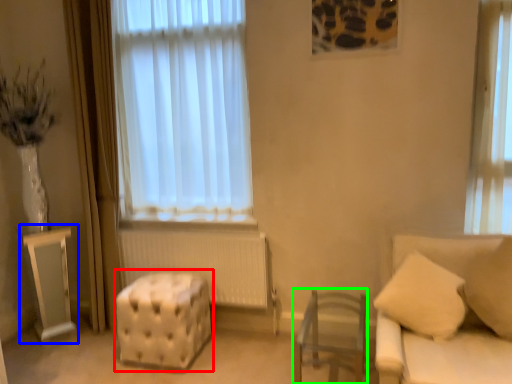
Question: Which object is the farthest from stool (highlighted by a red box)? Choose among these: table (highlighted by a blue box) or furniture (highlighted by a green box).

Choices:
 (A) table
 (B) furniture

Answer: (B)